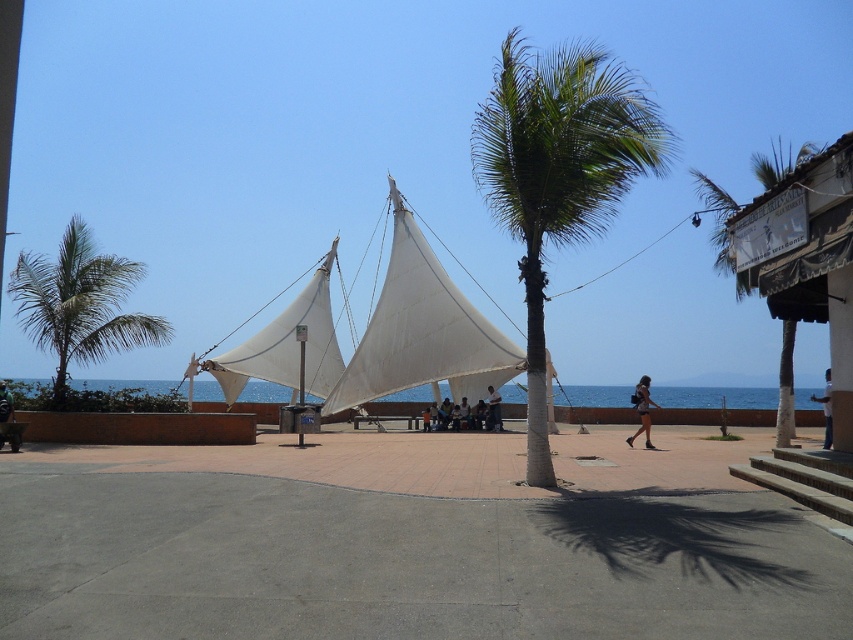
Based on the photo, you are standing on the paved area and want to walk towards the white fabric sail at center. However, there is a matte white tent at center in the way. Can you walk directly to the sail without going around the tent?

The white fabric sail at center is closer to you than the matte white tent at center, so you can walk directly to the sail without needing to go around the tent.

You are planning to host a small outdoor event and need to choose between the white fabric sail at center and the matte white tent at center for shade. Based on the scene description, which option provides more coverage area?

The white fabric sail at center is larger in size than the matte white tent at center, so it provides more coverage area for shade.